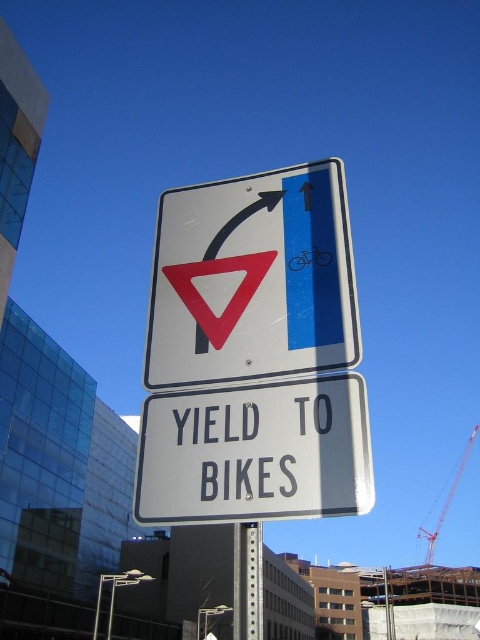
Which is more to the left, white plastic sign at center or red metal crane at upper right?

Positioned to the left is white plastic sign at center.

Does white plastic sign at center appear under red metal crane at upper right?

No.

Does point (238, 419) come in front of point (435, 522)?

Yes.

Where is `white plastic sign at center`? The image size is (480, 640). white plastic sign at center is located at coordinates (255, 452).

Can you confirm if metallic silver sign at center is taller than white plastic sign at center?

Yes.

Measure the distance between point (315, 320) and camera.

They are 1.66 meters apart.

Does point (280, 195) come farther from viewer compared to point (233, 515)?

Yes, it is behind point (233, 515).

Where is `metallic silver sign at center`? metallic silver sign at center is located at coordinates (252, 278).

Is metallic silver sign at center smaller than red metal crane at upper right?

Yes.

Looking at this image, does metallic silver sign at center appear on the left side of red metal crane at upper right?

Indeed, metallic silver sign at center is positioned on the left side of red metal crane at upper right.

Is point (252, 221) closer to camera compared to point (427, 550)?

Yes, it is.

Find the location of a particular element. The width and height of the screenshot is (480, 640). metallic silver sign at center is located at coordinates (252, 278).